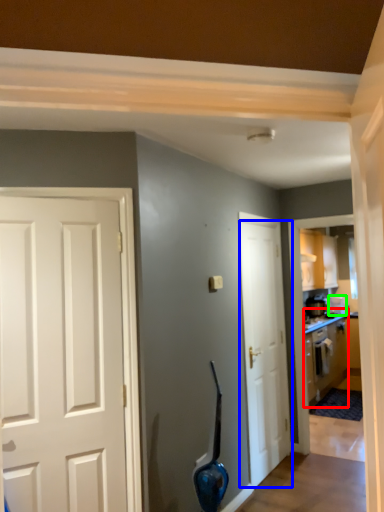
Question: Which object is positioned farthest from cabinetry (highlighted by a red box)? Select from door (highlighted by a blue box) and appliance (highlighted by a green box).

Choices:
 (A) door
 (B) appliance

Answer: (A)